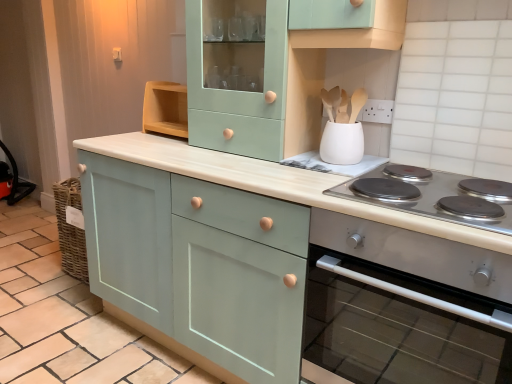
I want to click on white matte utensil holder at upper center, so click(342, 143).

In order to click on matte green cabinet at center, which is the 3th cabinetry from left to right in this screenshot , I will do `click(280, 185)`.

Considering the positions of point (106, 298) and point (426, 208), is point (106, 298) closer or farther from the camera than point (426, 208)?

Point (106, 298) is farther from the camera than point (426, 208).

Is matte teal cabinet at center, arranged as the 3th cabinetry when viewed from the right, smaller than silver metallic cooktop at lower right?

Incorrect, matte teal cabinet at center, arranged as the 3th cabinetry when viewed from the right, is not smaller in size than silver metallic cooktop at lower right.

Which object is further away from the camera, matte teal cabinet at center, placed as the 1th cabinetry when sorted from left to right, or silver metallic cooktop at lower right?

matte teal cabinet at center, placed as the 1th cabinetry when sorted from left to right, is behind.

Considering the sizes of objects matte teal cabinet at center, placed as the 1th cabinetry when sorted from left to right, and silver metallic cooktop at lower right in the image provided, who is taller, matte teal cabinet at center, placed as the 1th cabinetry when sorted from left to right, or silver metallic cooktop at lower right?

Standing taller between the two is matte teal cabinet at center, placed as the 1th cabinetry when sorted from left to right.

Consider the image. Is satin silver oven at right facing away from mint green wood cabinet at upper center, acting as the 2th cabinetry starting from the left?

No, satin silver oven at right's orientation is not away from mint green wood cabinet at upper center, acting as the 2th cabinetry starting from the left.

Which point is more forward, (x=374, y=237) or (x=317, y=64)?

Positioned in front is point (x=374, y=237).

From the image's perspective, which cabinetry is the 2nd one above the satin silver oven at right? Please provide its 2D coordinates.

[(272, 68)]

Considering the sizes of objects satin silver oven at right and mint green wood cabinet at upper center, acting as the 2th cabinetry starting from the left, in the image provided, who is thinner, satin silver oven at right or mint green wood cabinet at upper center, acting as the 2th cabinetry starting from the left,?

mint green wood cabinet at upper center, acting as the 2th cabinetry starting from the left, is thinner.

Measure the distance from matte green cabinet at center, which is the 3th cabinetry from left to right, to matte teal cabinet at center, placed as the 1th cabinetry when sorted from left to right.

11.87 inches.

Which of these two, matte green cabinet at center, which is the 3th cabinetry from left to right, or matte teal cabinet at center, arranged as the 3th cabinetry when viewed from the right, stands taller?

With more height is matte green cabinet at center, which is the 3th cabinetry from left to right.

Is matte green cabinet at center, acting as the 1th cabinetry starting from the right, oriented away from matte teal cabinet at center, placed as the 1th cabinetry when sorted from left to right?

No, matte green cabinet at center, acting as the 1th cabinetry starting from the right, is not facing the opposite direction of matte teal cabinet at center, placed as the 1th cabinetry when sorted from left to right.

Is matte green cabinet at center, which is the 3th cabinetry from left to right, inside or outside of matte teal cabinet at center, arranged as the 3th cabinetry when viewed from the right?

The correct answer is: outside.

Which object is positioned more to the left, matte green cabinet at center, which is the 3th cabinetry from left to right, or white matte utensil holder at upper center?

matte green cabinet at center, which is the 3th cabinetry from left to right, is more to the left.

Considering the sizes of matte green cabinet at center, which is the 3th cabinetry from left to right, and white matte utensil holder at upper center in the image, is matte green cabinet at center, which is the 3th cabinetry from left to right, wider or thinner than white matte utensil holder at upper center?

Clearly, matte green cabinet at center, which is the 3th cabinetry from left to right, has more width compared to white matte utensil holder at upper center.

In the scene shown: From a real-world perspective, is matte green cabinet at center, acting as the 1th cabinetry starting from the right, above or below white matte utensil holder at upper center?

From a real-world perspective, matte green cabinet at center, acting as the 1th cabinetry starting from the right, is physically below white matte utensil holder at upper center.

Considering the points (432, 237) and (327, 146), which point is behind, point (432, 237) or point (327, 146)?

The point (327, 146) is farther.

Is silver metallic cooktop at lower right oriented away from mint green wood cabinet at upper center, acting as the 2th cabinetry starting from the left?

silver metallic cooktop at lower right is not turned away from mint green wood cabinet at upper center, acting as the 2th cabinetry starting from the left.

What's the angular difference between silver metallic cooktop at lower right and mint green wood cabinet at upper center, which appears as the second cabinetry when viewed from the right,'s facing directions?

The facing directions of silver metallic cooktop at lower right and mint green wood cabinet at upper center, which appears as the second cabinetry when viewed from the right, are 0.201 degrees apart.

Can we say silver metallic cooktop at lower right lies outside mint green wood cabinet at upper center, which appears as the second cabinetry when viewed from the right?

Yes, silver metallic cooktop at lower right is not within mint green wood cabinet at upper center, which appears as the second cabinetry when viewed from the right.

Does point (362, 174) come behind point (204, 136)?

No, (362, 174) is closer to viewer.

What are the coordinates of `home appliance that is above the matte teal cabinet at center, arranged as the 3th cabinetry when viewed from the right (from the image's perspective)` in the screenshot? It's located at (404, 306).

Is satin silver oven at right directly adjacent to matte teal cabinet at center, placed as the 1th cabinetry when sorted from left to right?

No, satin silver oven at right is not beside matte teal cabinet at center, placed as the 1th cabinetry when sorted from left to right.

Is satin silver oven at right at the right side of matte teal cabinet at center, placed as the 1th cabinetry when sorted from left to right?

Indeed, satin silver oven at right is positioned on the right side of matte teal cabinet at center, placed as the 1th cabinetry when sorted from left to right.

This screenshot has width=512, height=384. What are the coordinates of `gas stove in front of the mint green wood cabinet at upper center, which appears as the second cabinetry when viewed from the right` in the screenshot? It's located at (426, 199).

Is mint green wood cabinet at upper center, which appears as the second cabinetry when viewed from the right, to the left of silver metallic cooktop at lower right from the viewer's perspective?

Yes.

Consider the image. Which of these two, mint green wood cabinet at upper center, acting as the 2th cabinetry starting from the left, or silver metallic cooktop at lower right, is wider?

With larger width is silver metallic cooktop at lower right.

Measure the distance between mint green wood cabinet at upper center, acting as the 2th cabinetry starting from the left, and silver metallic cooktop at lower right.

23.36 inches.

Locate an element on the screen. Image resolution: width=512 pixels, height=384 pixels. gas stove to the right of matte teal cabinet at center, placed as the 1th cabinetry when sorted from left to right is located at coordinates (426, 199).

Find the location of a particular element. This screenshot has width=512, height=384. cabinetry that appears above the satin silver oven at right (from a real-world perspective) is located at coordinates (272, 68).

From the image, which object appears to be farther from mint green wood cabinet at upper center, which appears as the second cabinetry when viewed from the right, silver metallic cooktop at lower right or satin silver oven at right?

The object further to mint green wood cabinet at upper center, which appears as the second cabinetry when viewed from the right, is satin silver oven at right.

When comparing their distances from satin silver oven at right, does matte teal cabinet at center, placed as the 1th cabinetry when sorted from left to right, or mint green wood cabinet at upper center, acting as the 2th cabinetry starting from the left, seem closer?

matte teal cabinet at center, placed as the 1th cabinetry when sorted from left to right, is closer to satin silver oven at right.

Based on their spatial positions, is silver metallic cooktop at lower right or matte green cabinet at center, acting as the 1th cabinetry starting from the right, closer to mint green wood cabinet at upper center, acting as the 2th cabinetry starting from the left?

matte green cabinet at center, acting as the 1th cabinetry starting from the right, is closer to mint green wood cabinet at upper center, acting as the 2th cabinetry starting from the left.

Considering their positions, is satin silver oven at right positioned further to matte teal cabinet at center, arranged as the 3th cabinetry when viewed from the right, than silver metallic cooktop at lower right?

silver metallic cooktop at lower right lies further to matte teal cabinet at center, arranged as the 3th cabinetry when viewed from the right, than the other object.

Which object lies further to the anchor point mint green wood cabinet at upper center, which appears as the second cabinetry when viewed from the right, matte green cabinet at center, which is the 3th cabinetry from left to right, or silver metallic cooktop at lower right?

The object further to mint green wood cabinet at upper center, which appears as the second cabinetry when viewed from the right, is silver metallic cooktop at lower right.

When comparing their distances from matte green cabinet at center, acting as the 1th cabinetry starting from the right, does matte teal cabinet at center, arranged as the 3th cabinetry when viewed from the right, or satin silver oven at right seem further?

satin silver oven at right is further to matte green cabinet at center, acting as the 1th cabinetry starting from the right.

Considering their positions, is matte green cabinet at center, acting as the 1th cabinetry starting from the right, positioned further to matte teal cabinet at center, placed as the 1th cabinetry when sorted from left to right, than silver metallic cooktop at lower right?

Among the two, silver metallic cooktop at lower right is located further to matte teal cabinet at center, placed as the 1th cabinetry when sorted from left to right.

Which object lies nearer to the anchor point matte green cabinet at center, which is the 3th cabinetry from left to right, white matte utensil holder at upper center or matte teal cabinet at center, placed as the 1th cabinetry when sorted from left to right?

Among the two, matte teal cabinet at center, placed as the 1th cabinetry when sorted from left to right, is located nearer to matte green cabinet at center, which is the 3th cabinetry from left to right.

Locate an element on the screen. The width and height of the screenshot is (512, 384). home appliance between matte teal cabinet at center, arranged as the 3th cabinetry when viewed from the right, and silver metallic cooktop at lower right from left to right is located at coordinates (404, 306).

You are a GUI agent. You are given a task and a screenshot of the screen. Output one action in this format:
    pyautogui.click(x=<x>, y=<y>)
    Task: Click on the kitchen appliance located between mint green wood cabinet at upper center, which appears as the second cabinetry when viewed from the right, and silver metallic cooktop at lower right in the left-right direction
    This screenshot has height=384, width=512.
    Given the screenshot: What is the action you would take?
    342,143

Where is `gas stove between mint green wood cabinet at upper center, acting as the 2th cabinetry starting from the left, and matte green cabinet at center, which is the 3th cabinetry from left to right, from top to bottom`? gas stove between mint green wood cabinet at upper center, acting as the 2th cabinetry starting from the left, and matte green cabinet at center, which is the 3th cabinetry from left to right, from top to bottom is located at coordinates (426, 199).

Image resolution: width=512 pixels, height=384 pixels. I want to click on cabinetry between mint green wood cabinet at upper center, acting as the 2th cabinetry starting from the left, and satin silver oven at right from top to bottom, so click(x=280, y=185).